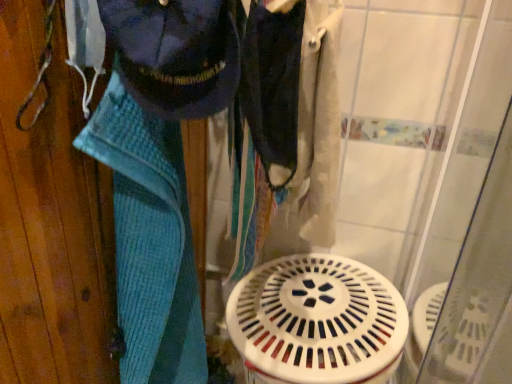
Measure the distance between white plastic water heater at center and camera.

35.45 inches.

This screenshot has width=512, height=384. Find the location of `dark blue fabric at center, the 1th clothing positioned from the right`. dark blue fabric at center, the 1th clothing positioned from the right is located at coordinates (273, 87).

Find the location of a particular element. This screenshot has height=384, width=512. navy blue fabric at upper left, acting as the second clothing starting from the right is located at coordinates (177, 53).

Find the location of a particular element. The image size is (512, 384). white plastic water heater at center is located at coordinates (317, 321).

Does point (101, 347) lie in front of point (259, 304)?

Yes, point (101, 347) is closer to viewer.

Considering the sizes of blue knitted towel at left and white plastic water heater at center in the image, is blue knitted towel at left taller or shorter than white plastic water heater at center?

In the image, blue knitted towel at left appears to be taller than white plastic water heater at center.

Between blue knitted towel at left and white plastic water heater at center, which one is positioned in front?

blue knitted towel at left is in front.

Is blue knitted towel at left not close to white plastic water heater at center?

They are positioned close to each other.

Does navy blue fabric at upper left, acting as the second clothing starting from the right, touch blue knitted towel at left?

No, navy blue fabric at upper left, acting as the second clothing starting from the right, is not in contact with blue knitted towel at left.

Based on the photo, which is nearer, (159, 88) or (49, 308)?

The point (159, 88) is more forward.

The height and width of the screenshot is (384, 512). I want to click on door located below the navy blue fabric at upper left, marked as the 1th clothing in a left-to-right arrangement (from the image's perspective), so click(x=51, y=219).

Does navy blue fabric at upper left, acting as the second clothing starting from the right, come behind blue knitted towel at left?

That is False.

Considering the relative sizes of white plastic water heater at center and dark blue fabric at center, which appears as the second clothing when viewed from the left, in the image provided, is white plastic water heater at center wider than dark blue fabric at center, which appears as the second clothing when viewed from the left,?

Yes.

Between white plastic water heater at center and dark blue fabric at center, the 1th clothing positioned from the right, which one appears on the right side from the viewer's perspective?

From the viewer's perspective, white plastic water heater at center appears more on the right side.

Is white plastic water heater at center oriented away from dark blue fabric at center, the 1th clothing positioned from the right?

No, dark blue fabric at center, the 1th clothing positioned from the right, is not at the back of white plastic water heater at center.

From a real-world perspective, is white plastic water heater at center on dark blue fabric at center, the 1th clothing positioned from the right?

Incorrect, from a real-world perspective, white plastic water heater at center is lower than dark blue fabric at center, the 1th clothing positioned from the right.

Do you think blue knitted towel at left is within dark blue fabric at center, which appears as the second clothing when viewed from the left, or outside of it?

blue knitted towel at left is located beyond the bounds of dark blue fabric at center, which appears as the second clothing when viewed from the left.

Which is in front, point (5, 115) or point (254, 131)?

Positioned in front is point (5, 115).

Is blue knitted towel at left bigger than dark blue fabric at center, which appears as the second clothing when viewed from the left?

Correct, blue knitted towel at left is larger in size than dark blue fabric at center, which appears as the second clothing when viewed from the left.

In the image, there is a navy blue fabric at upper left, marked as the 1th clothing in a left-to-right arrangement. At what (x,y) coordinates should I click in order to perform the action: click on water heater below it (from a real-world perspective). Please return your answer as a coordinate pair (x, y). This screenshot has width=512, height=384. Looking at the image, I should click on (317, 321).

Which object is further away from the camera, white plastic water heater at center or navy blue fabric at upper left, acting as the second clothing starting from the right?

Positioned behind is white plastic water heater at center.

Between white plastic water heater at center and navy blue fabric at upper left, acting as the second clothing starting from the right, which one has less height?

white plastic water heater at center.

Is dark blue fabric at center, the 1th clothing positioned from the right, smaller than navy blue fabric at upper left, acting as the second clothing starting from the right?

Yes, dark blue fabric at center, the 1th clothing positioned from the right, is smaller than navy blue fabric at upper left, acting as the second clothing starting from the right.

Does point (280, 187) lie in front of point (149, 69)?

No, it is not.

Does dark blue fabric at center, which appears as the second clothing when viewed from the left, have a greater width compared to navy blue fabric at upper left, marked as the 1th clothing in a left-to-right arrangement?

No.

Consider the image. From a real-world perspective, who is located lower, dark blue fabric at center, which appears as the second clothing when viewed from the left, or navy blue fabric at upper left, acting as the second clothing starting from the right?

dark blue fabric at center, which appears as the second clothing when viewed from the left, from a real-world perspective.

From a real-world perspective, is white plastic water heater at center physically located above or below blue knitted towel at left?

white plastic water heater at center is situated lower than blue knitted towel at left in the real world.

Considering the positions of objects white plastic water heater at center and blue knitted towel at left in the image provided, who is in front, white plastic water heater at center or blue knitted towel at left?

blue knitted towel at left is more forward.

Can you confirm if white plastic water heater at center is taller than blue knitted towel at left?

No, white plastic water heater at center is not taller than blue knitted towel at left.

Consider the image. Is white plastic water heater at center surrounding blue knitted towel at left?

No, blue knitted towel at left is located outside of white plastic water heater at center.

The image size is (512, 384). What are the coordinates of `door that is above the white plastic water heater at center (from the image's perspective)` in the screenshot? It's located at (51, 219).

This screenshot has width=512, height=384. Find the location of `door located below the navy blue fabric at upper left, acting as the second clothing starting from the right (from the image's perspective)`. door located below the navy blue fabric at upper left, acting as the second clothing starting from the right (from the image's perspective) is located at coordinates (51, 219).

Looking at the image, which one is located closer to dark blue fabric at center, the 1th clothing positioned from the right, white plastic water heater at center or blue knitted towel at left?

The object closer to dark blue fabric at center, the 1th clothing positioned from the right, is blue knitted towel at left.

Which object lies nearer to the anchor point white plastic water heater at center, dark blue fabric at center, which appears as the second clothing when viewed from the left, or blue knitted towel at left?

dark blue fabric at center, which appears as the second clothing when viewed from the left, is closer to white plastic water heater at center.

Based on the photo, considering their positions, is blue knitted towel at left positioned further to dark blue fabric at center, which appears as the second clothing when viewed from the left, than navy blue fabric at upper left, acting as the second clothing starting from the right?

blue knitted towel at left.

Which object lies nearer to the anchor point white plastic water heater at center, navy blue fabric at upper left, acting as the second clothing starting from the right, or blue knitted towel at left?

Among the two, blue knitted towel at left is located nearer to white plastic water heater at center.

Based on their spatial positions, is white plastic water heater at center or navy blue fabric at upper left, acting as the second clothing starting from the right, closer to blue knitted towel at left?

navy blue fabric at upper left, acting as the second clothing starting from the right, is positioned closer to the anchor blue knitted towel at left.

When comparing their distances from white plastic water heater at center, does navy blue fabric at upper left, acting as the second clothing starting from the right, or dark blue fabric at center, which appears as the second clothing when viewed from the left, seem further?

navy blue fabric at upper left, acting as the second clothing starting from the right, is positioned further to the anchor white plastic water heater at center.

Looking at this image, estimate the real-world distances between objects in this image. Which object is closer to dark blue fabric at center, the 1th clothing positioned from the right, navy blue fabric at upper left, marked as the 1th clothing in a left-to-right arrangement, or blue knitted towel at left?

navy blue fabric at upper left, marked as the 1th clothing in a left-to-right arrangement, is positioned closer to the anchor dark blue fabric at center, the 1th clothing positioned from the right.

From the image, which object appears to be farther from navy blue fabric at upper left, marked as the 1th clothing in a left-to-right arrangement, white plastic water heater at center or dark blue fabric at center, which appears as the second clothing when viewed from the left?

white plastic water heater at center is further to navy blue fabric at upper left, marked as the 1th clothing in a left-to-right arrangement.

At what (x,y) coordinates should I click in order to perform the action: click on door between navy blue fabric at upper left, acting as the second clothing starting from the right, and white plastic water heater at center in the up-down direction. Please return your answer as a coordinate pair (x, y). Looking at the image, I should click on (51, 219).

Find the location of a particular element. Image resolution: width=512 pixels, height=384 pixels. clothing between navy blue fabric at upper left, marked as the 1th clothing in a left-to-right arrangement, and white plastic water heater at center from top to bottom is located at coordinates (273, 87).

Identify the location of door between dark blue fabric at center, the 1th clothing positioned from the right, and white plastic water heater at center from front to back. (51, 219).

Where is `clothing between navy blue fabric at upper left, acting as the second clothing starting from the right, and blue knitted towel at left, in the vertical direction`? The image size is (512, 384). clothing between navy blue fabric at upper left, acting as the second clothing starting from the right, and blue knitted towel at left, in the vertical direction is located at coordinates pos(273,87).